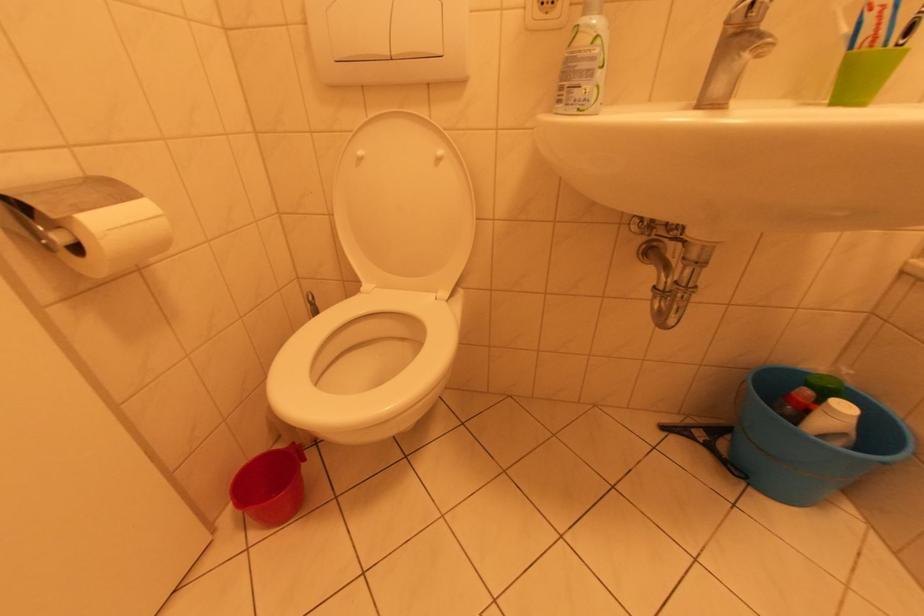
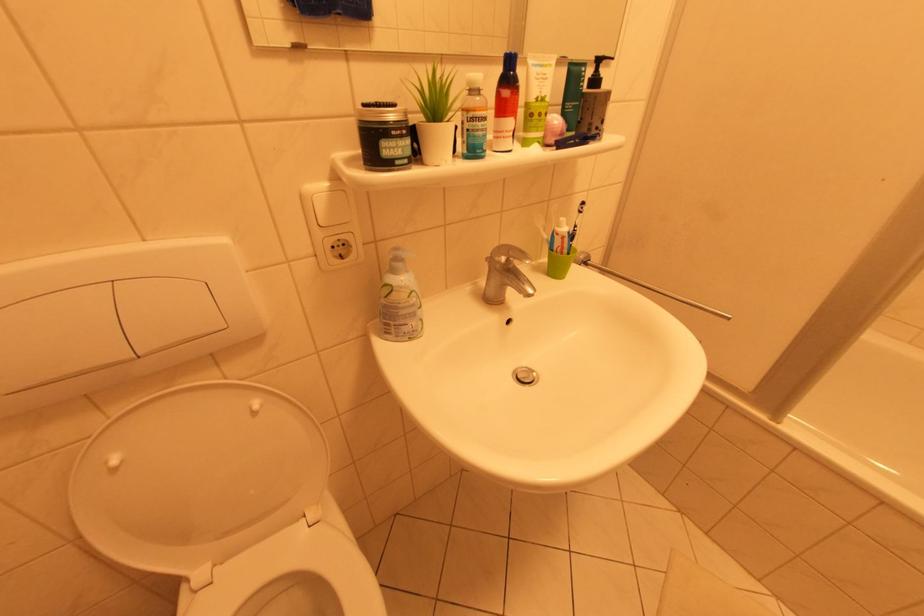
Question: The camera is either moving clockwise (left) or counter-clockwise (right) around the object. The first image is from the beginning of the video and the second image is from the end. Is the camera moving left or right when shooting the video?

Choices:
 (A) Left
 (B) Right

Answer: (A)